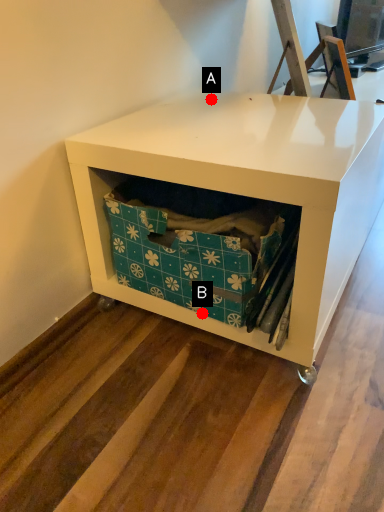
Question: Two points are circled on the image, labeled by A and B beside each circle. Which of the following is the closest to the observer?

Choices:
 (A) A is closer
 (B) B is closer

Answer: (B)